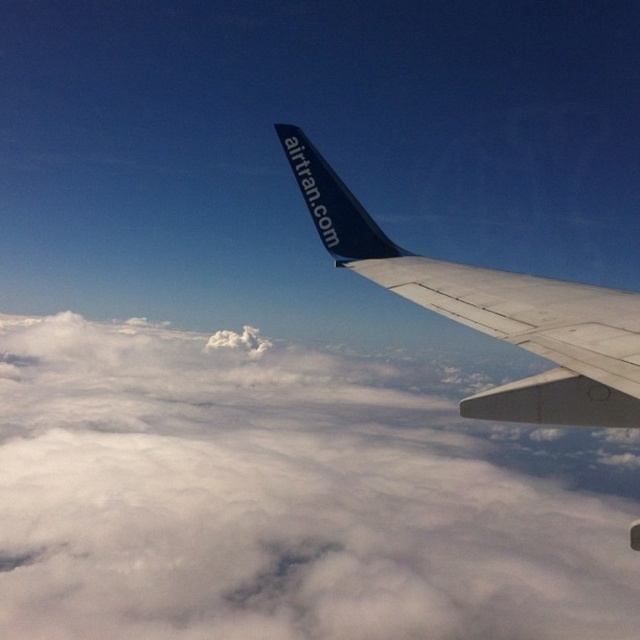
You are a passenger looking out the airplane window. You see the white fluffy cloud at upper center and the matte blue wing at upper right. Which object is closer to you?

The white fluffy cloud at upper center is closer to the viewer than the matte blue wing at upper right.

You are a passenger looking out the airplane window and see two points in the scene. One is at point coordinates point [12,461] and the other is at point coordinates point [516,307]. Which point is closer to you?

Point [12,461] is further to the camera than point [516,307], so the point closer to you is point [516,307].